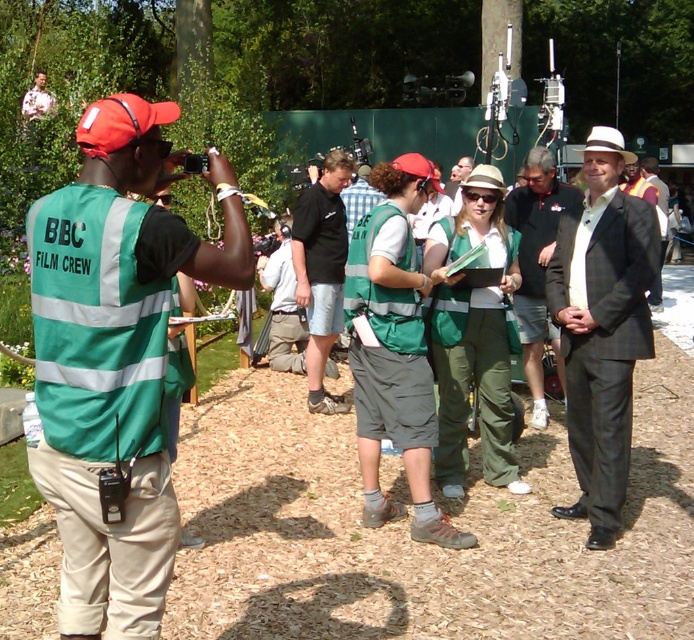
Can you confirm if black cotton shirt at center is bigger than dark gray suit at center?

Actually, black cotton shirt at center might be smaller than dark gray suit at center.

Does point (321, 365) lie behind point (530, 236)?

That is True.

Locate an element on the screen. black cotton shirt at center is located at coordinates (321, 272).

Between point (607, 252) and point (524, 218), which one is positioned behind?

Positioned behind is point (524, 218).

The height and width of the screenshot is (640, 694). Identify the location of matte black suit at right. (602, 326).

Can you confirm if green reflective vest at left is wider than matte black suit at right?

Indeed, green reflective vest at left has a greater width compared to matte black suit at right.

Is green reflective vest at left in front of matte black suit at right?

Yes, green reflective vest at left is in front of matte black suit at right.

Does point (126, 337) come farther from viewer compared to point (632, 326)?

No, it is in front of (632, 326).

Where is `green reflective vest at left`? This screenshot has width=694, height=640. green reflective vest at left is located at coordinates (115, 356).